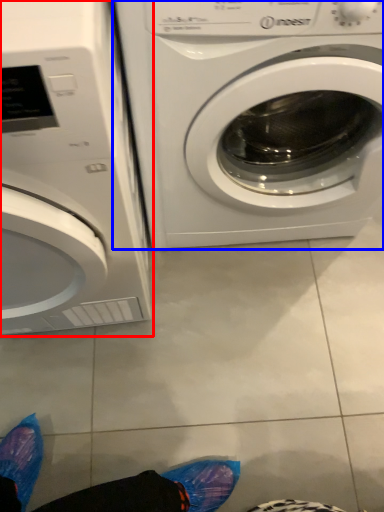
Question: Which point is closer to the camera, washing machine (highlighted by a red box) or washing machine (highlighted by a blue box)?

Choices:
 (A) washing machine
 (B) washing machine

Answer: (A)